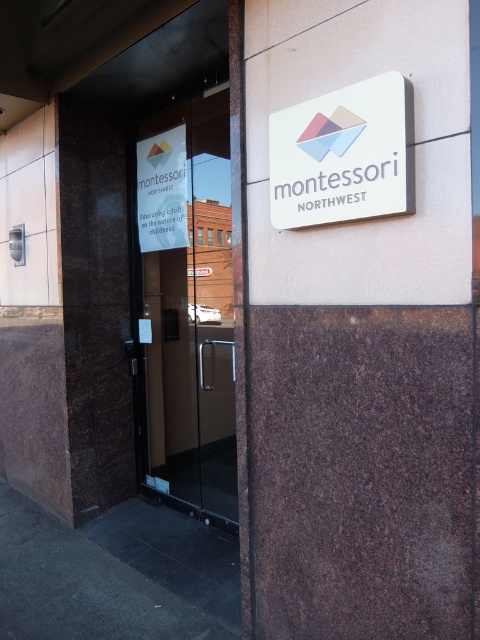
You are a visitor approaching the entrance of Montessori Northwest. You need to find the main entrance door. Which object is taller between the transparent glass door at center and the white paper sign at left?

The transparent glass door at center is much taller than the white paper sign at left, so the main entrance door is the transparent glass door at center.